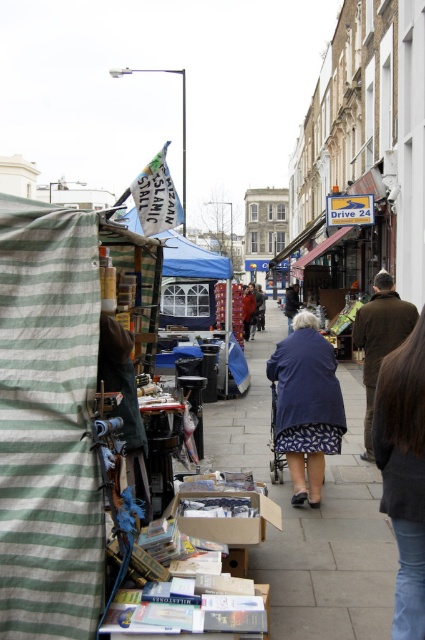
You are a customer standing in front of the market stall. You notice two blue fabrics. The first is the blue fabric at center, and the second is the blue fabric canopy at upper center. Which of these two fabrics is wider?

The blue fabric canopy at upper center is wider than the blue fabric at center.

You are standing on the sidewalk near the Islamic Stall and see both the blue fabric at center and the blue fabric jacket at center. Which one is positioned more to the right side?

The blue fabric at center is more to the right than the blue fabric jacket at center.